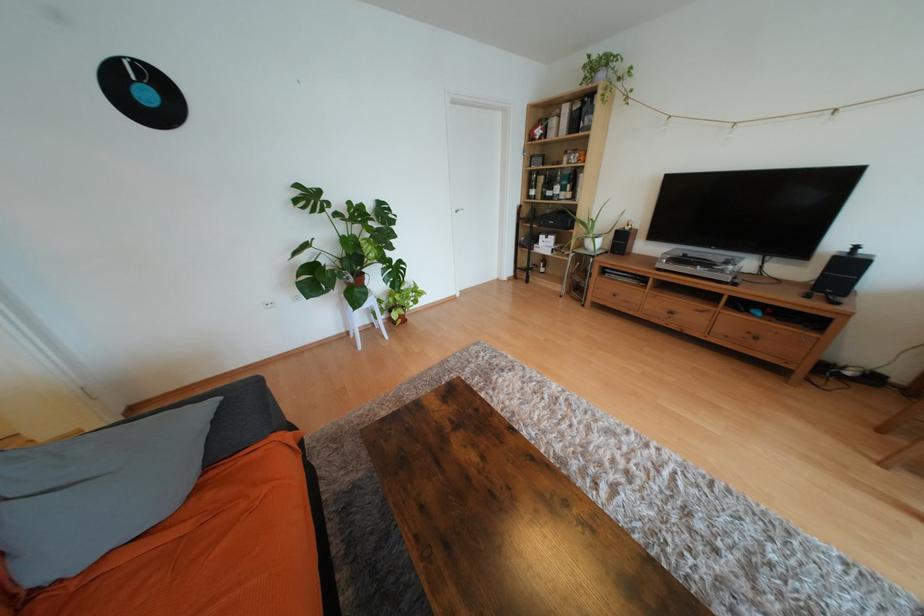
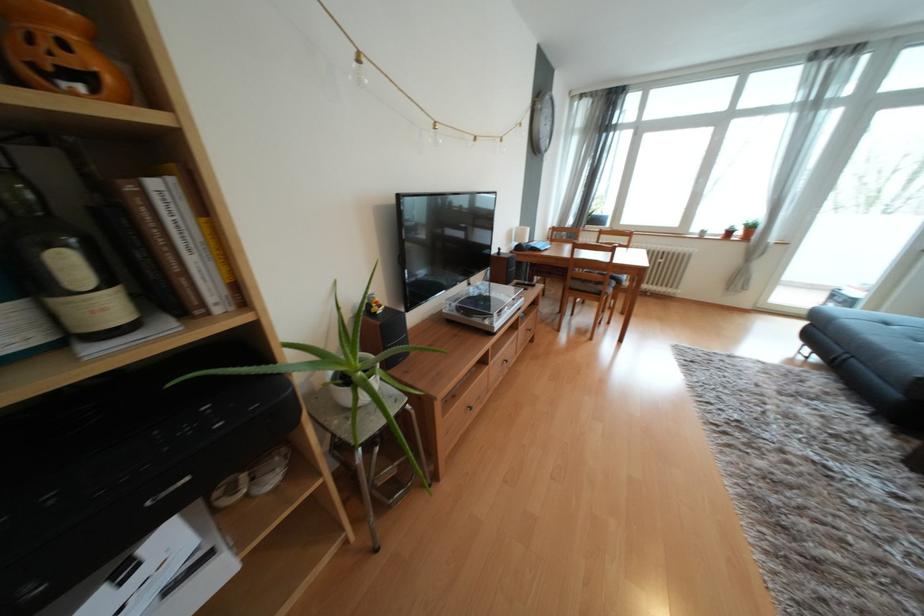
In the second image, find the point that corresponds to the point at 575,196 in the first image.

(111, 308)